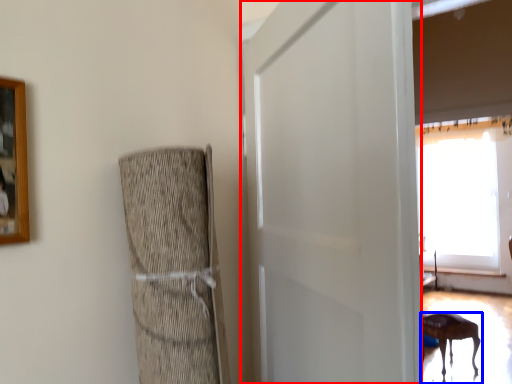
Question: Which of the following is the farthest to the observer, screen door (highlighted by a red box) or furniture (highlighted by a blue box)?

Choices:
 (A) screen door
 (B) furniture

Answer: (B)